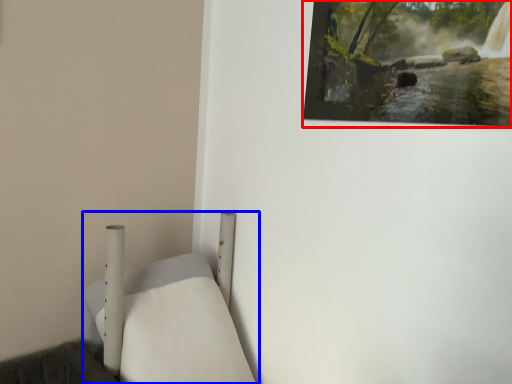
Question: Which object is closer to the camera taking this photo, picture frame (highlighted by a red box) or furniture (highlighted by a blue box)?

Choices:
 (A) picture frame
 (B) furniture

Answer: (B)